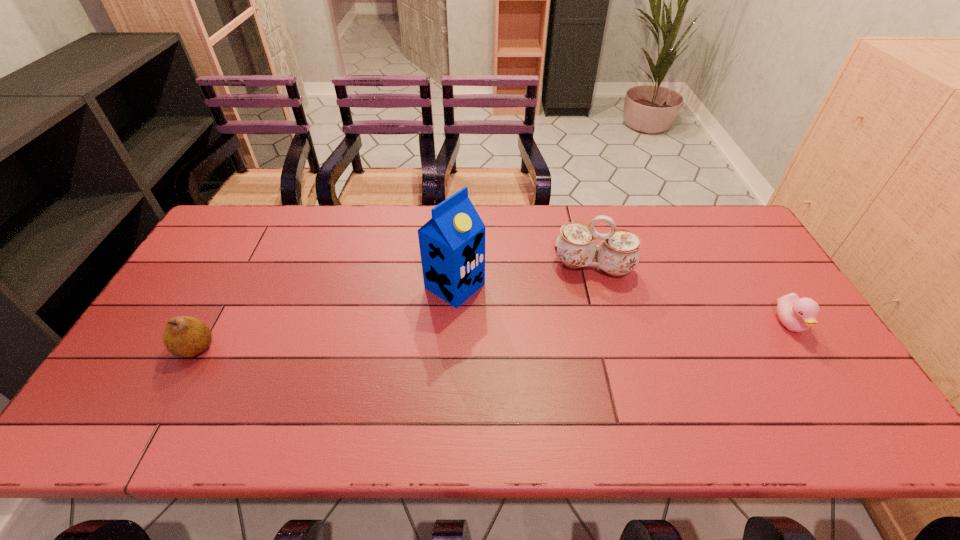
Identify the location of free space between the third object from left to right and the tallest object. This screenshot has height=540, width=960. (524, 276).

This screenshot has height=540, width=960. Find the location of `free spot between the chinaware and the shortest object`. free spot between the chinaware and the shortest object is located at coordinates (691, 295).

Where is `free space between the duckling and the tallest object`? The image size is (960, 540). free space between the duckling and the tallest object is located at coordinates (622, 305).

Locate an element on the screen. free spot between the duckling and the carton is located at coordinates (622, 305).

This screenshot has height=540, width=960. In order to click on free spot between the chinaware and the carton in this screenshot , I will do `click(524, 276)`.

Identify the location of free space between the chinaware and the carton. The width and height of the screenshot is (960, 540). (524, 276).

I want to click on object that is the third closest to the tallest object, so click(797, 314).

Identify which object is located as the second nearest to the pear. Please provide its 2D coordinates. Your answer should be formatted as a tuple, i.e. [(x, y)], where the tuple contains the x and y coordinates of a point satisfying the conditions above.

[(618, 254)]